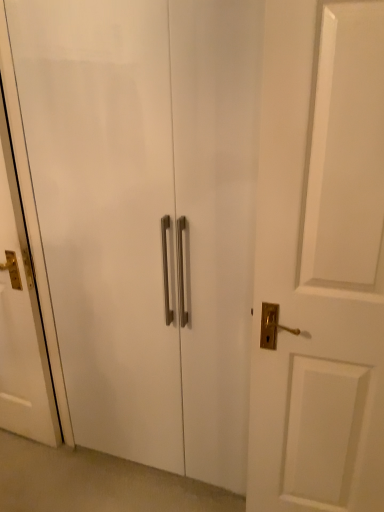
Question: Do you think white glossy door at left is within white glossy cabinet at center, or outside of it?

Choices:
 (A) outside
 (B) inside

Answer: (A)

Question: From the image's perspective, is white glossy door at left located above or below white glossy cabinet at center?

Choices:
 (A) above
 (B) below

Answer: (A)

Question: From a real-world perspective, is white glossy door at left physically located above or below white glossy cabinet at center?

Choices:
 (A) below
 (B) above

Answer: (A)

Question: From a real-world perspective, is white glossy cabinet at center physically located above or below white glossy door at left?

Choices:
 (A) below
 (B) above

Answer: (B)

Question: Considering the positions of white glossy cabinet at center and white glossy door at left in the image, is white glossy cabinet at center taller or shorter than white glossy door at left?

Choices:
 (A) tall
 (B) short

Answer: (A)

Question: Is white glossy cabinet at center spatially inside white glossy door at left, or outside of it?

Choices:
 (A) outside
 (B) inside

Answer: (A)

Question: Considering their positions, is white glossy cabinet at center located in front of or behind white glossy door at left?

Choices:
 (A) behind
 (B) front

Answer: (B)